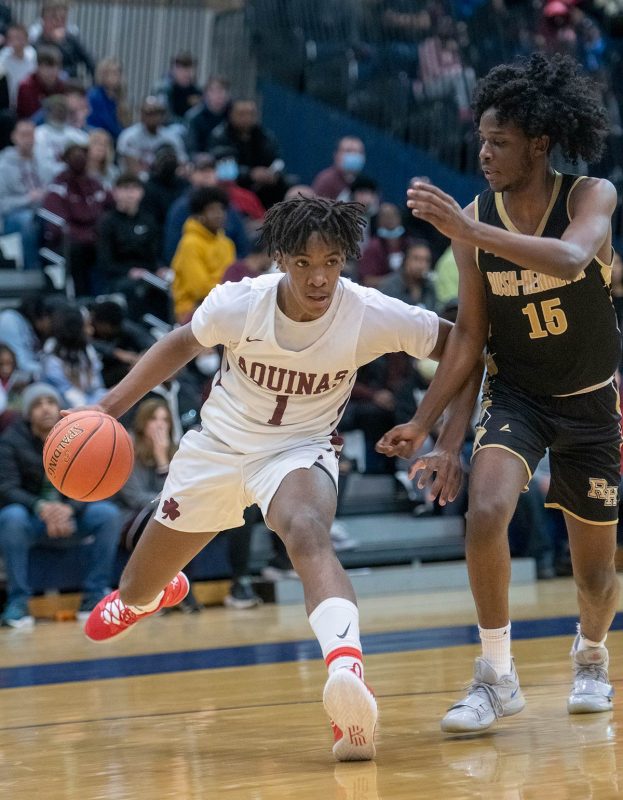
The height and width of the screenshot is (800, 623). Find the location of `shiny gymnasium floor`. shiny gymnasium floor is located at coordinates (108, 766), (255, 678), (70, 646), (407, 608), (415, 738), (589, 777), (559, 598).